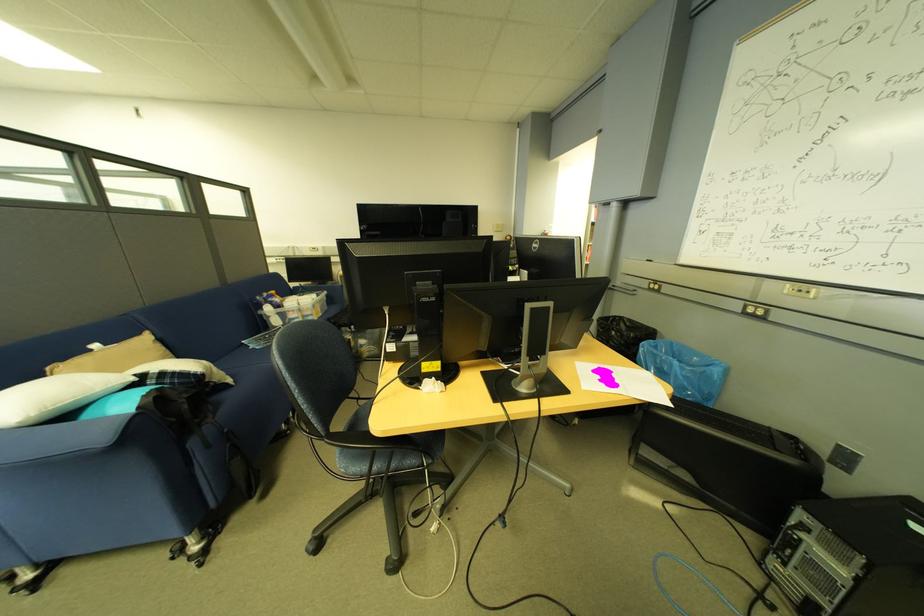
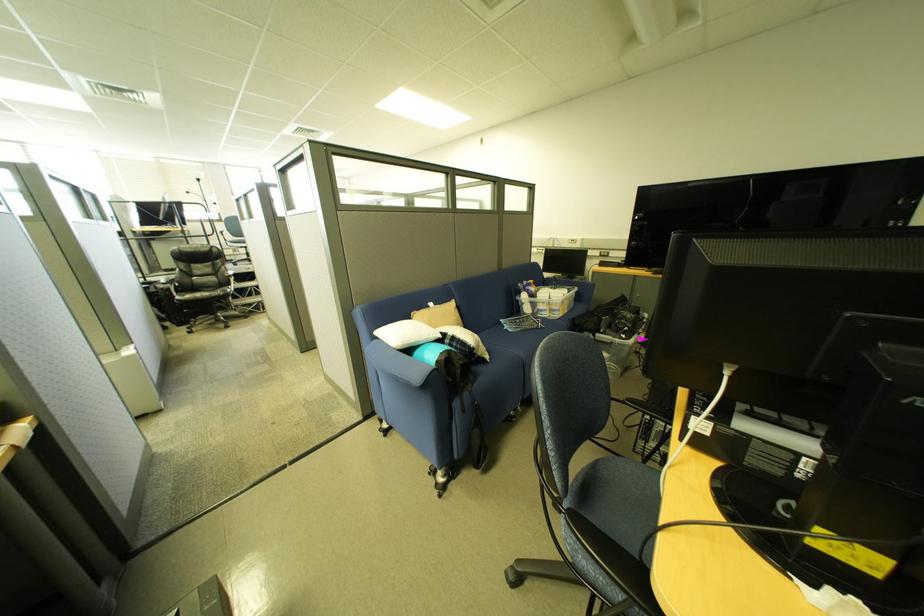
In the second image, find the point that corresponds to (x=100, y=416) in the first image.

(429, 355)